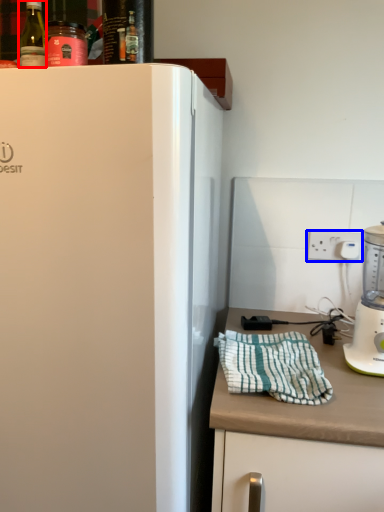
Question: Which point is closer to the camera, bottle (highlighted by a red box) or electric outlet (highlighted by a blue box)?

Choices:
 (A) bottle
 (B) electric outlet

Answer: (A)